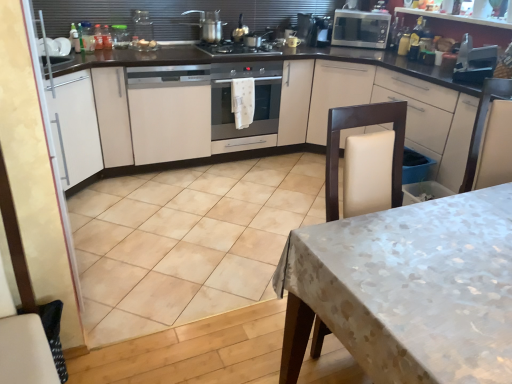
Describe the element at coordinates (74, 127) in the screenshot. I see `white matte cabinet at left, the first cabinetry viewed from the left` at that location.

Locate an element on the screen. This screenshot has width=512, height=384. metallic silver pot at upper center, the second kitchen appliance viewed from the back is located at coordinates (208, 25).

At what (x,y) coordinates should I click in order to perform the action: click on silver metallic microwave at upper right, placed as the first kitchen appliance when sorted from back to front. Please return your answer as a coordinate pair (x, y). Image resolution: width=512 pixels, height=384 pixels. Looking at the image, I should click on (360, 29).

What is the approximate height of white textured tablecloth at lower right?

white textured tablecloth at lower right is 29.78 inches in height.

Describe the element at coordinates (314, 29) in the screenshot. The image size is (512, 384). I see `metallic microwave at upper right, which appears as the 2th appliance when viewed from the front` at that location.

Identify the location of white matte cabinet at upper right, arranged as the 3th cabinetry when viewed from the left. (407, 111).

Could white matte cabinet at upper right, arranged as the 3th cabinetry when viewed from the left, be considered to be inside metallic microwave at upper right, positioned as the 1th appliance in top-to-bottom order?

No, white matte cabinet at upper right, arranged as the 3th cabinetry when viewed from the left, is not inside metallic microwave at upper right, positioned as the 1th appliance in top-to-bottom order.

Would you say metallic microwave at upper right, the 1th appliance in the left-to-right sequence, is to the left or to the right of white matte cabinet at upper right, arranged as the 3th cabinetry when viewed from the left, in the picture?

Based on their positions, metallic microwave at upper right, the 1th appliance in the left-to-right sequence, is located to the left of white matte cabinet at upper right, arranged as the 3th cabinetry when viewed from the left.

Is metallic microwave at upper right, the 1th appliance in the left-to-right sequence, oriented away from white matte cabinet at upper right, arranged as the 3th cabinetry when viewed from the left?

No, metallic microwave at upper right, the 1th appliance in the left-to-right sequence, is not facing the opposite direction of white matte cabinet at upper right, arranged as the 3th cabinetry when viewed from the left.

Considering the sizes of objects metallic microwave at upper right, which appears as the 2th appliance when viewed from the front, and white matte cabinet at upper right, arranged as the 3th cabinetry when viewed from the left, in the image provided, who is wider, metallic microwave at upper right, which appears as the 2th appliance when viewed from the front, or white matte cabinet at upper right, arranged as the 3th cabinetry when viewed from the left,?

white matte cabinet at upper right, arranged as the 3th cabinetry when viewed from the left, is wider.

Is black matte gas stove at center surrounded by white matte cabinet at center, the second cabinetry in the left-to-right sequence?

No.

Does point (148, 157) come in front of point (259, 51)?

Yes, it is in front of point (259, 51).

Between white matte cabinet at center, the second cabinetry in the left-to-right sequence, and black matte gas stove at center, which one appears on the left side from the viewer's perspective?

Positioned to the left is white matte cabinet at center, the second cabinetry in the left-to-right sequence.

Can you see white matte cabinet at center, the second cabinetry in the left-to-right sequence, touching black matte gas stove at center?

No, white matte cabinet at center, the second cabinetry in the left-to-right sequence, is not with black matte gas stove at center.

Based on the photo, is white textured tablecloth at lower right not close to white matte cabinet at left, the first cabinetry viewed from the left?

That's right, there is a large distance between white textured tablecloth at lower right and white matte cabinet at left, the first cabinetry viewed from the left.

From a real-world perspective, which object stands above the other?

white matte cabinet at left, the first cabinetry viewed from the left.

Considering the positions of points (298, 36) and (194, 113), is point (298, 36) farther from camera compared to point (194, 113)?

Yes.

From the image's perspective, which cabinetry is the 2nd one below the metallic microwave at upper right, the 1th appliance in the left-to-right sequence? Please provide its 2D coordinates.

[(169, 112)]

How much distance is there between metallic microwave at upper right, the 2th appliance ordered from the bottom, and white matte cabinet at center, the second cabinetry in the left-to-right sequence?

A distance of 1.45 meters exists between metallic microwave at upper right, the 2th appliance ordered from the bottom, and white matte cabinet at center, the second cabinetry in the left-to-right sequence.

Between metallic microwave at upper right, marked as the 2th appliance in a right-to-left arrangement, and white matte cabinet at center, the 2th cabinetry in the right-to-left sequence, which one appears on the right side from the viewer's perspective?

metallic microwave at upper right, marked as the 2th appliance in a right-to-left arrangement, is more to the right.

Considering the relative sizes of white textured tablecloth at lower right and black matte gas stove at center in the image provided, is white textured tablecloth at lower right wider than black matte gas stove at center?

Yes, white textured tablecloth at lower right is wider than black matte gas stove at center.

Between white textured tablecloth at lower right and black matte gas stove at center, which one appears on the right side from the viewer's perspective?

Positioned to the right is white textured tablecloth at lower right.

Is white textured tablecloth at lower right not close to black matte gas stove at center?

Yes, white textured tablecloth at lower right is far from black matte gas stove at center.

What's the angular difference between white textured tablecloth at lower right and black matte gas stove at center's facing directions?

91.3 degrees separate the facing orientations of white textured tablecloth at lower right and black matte gas stove at center.

Is white matte cabinet at left, the third cabinetry viewed from the right, thinner than black matte gas stove at center?

No.

Based on the photo, which object is further away from the camera taking this photo, white matte cabinet at left, the third cabinetry viewed from the right, or black matte gas stove at center?

black matte gas stove at center is further away from the camera.

Which of these two, white matte cabinet at left, the third cabinetry viewed from the right, or black matte gas stove at center, is bigger?

With larger size is white matte cabinet at left, the third cabinetry viewed from the right.

Considering the relative positions of white matte cabinet at left, the first cabinetry viewed from the left, and black matte gas stove at center in the image provided, is white matte cabinet at left, the first cabinetry viewed from the left, to the right of black matte gas stove at center from the viewer's perspective?

No, white matte cabinet at left, the first cabinetry viewed from the left, is not to the right of black matte gas stove at center.

Considering the sizes of objects white matte cabinet at center, the second cabinetry in the left-to-right sequence, and satin silver oven at center in the image provided, who is thinner, white matte cabinet at center, the second cabinetry in the left-to-right sequence, or satin silver oven at center?

satin silver oven at center is thinner.

Would you say white matte cabinet at center, the 2th cabinetry in the right-to-left sequence, is inside or outside satin silver oven at center?

white matte cabinet at center, the 2th cabinetry in the right-to-left sequence, is outside satin silver oven at center.

Between white matte cabinet at center, the second cabinetry in the left-to-right sequence, and satin silver oven at center, which one appears on the right side from the viewer's perspective?

Positioned to the right is satin silver oven at center.

From the picture: Which object is closer to the camera, white matte cabinet at center, the 2th cabinetry in the right-to-left sequence, or satin silver oven at center?

white matte cabinet at center, the 2th cabinetry in the right-to-left sequence.

Image resolution: width=512 pixels, height=384 pixels. In the image, there is a white matte cabinet at upper right, which is counted as the first cabinetry, starting from the right. What are the coordinates of `appliance above it (from the image's perspective)` in the screenshot? It's located at (314, 29).

This screenshot has width=512, height=384. What are the coordinates of `the 1st cabinetry in front of the black matte gas stove at center, starting your count from the anchor` in the screenshot? It's located at (169, 112).

Which object lies further to the anchor point metallic microwave at upper right, marked as the 2th appliance in a right-to-left arrangement, metallic silver toaster at upper right, arranged as the 2th appliance when viewed from the back, or black matte gas stove at center?

metallic silver toaster at upper right, arranged as the 2th appliance when viewed from the back, lies further to metallic microwave at upper right, marked as the 2th appliance in a right-to-left arrangement, than the other object.

Looking at the image, which one is located further to metallic silver toaster at upper right, placed as the first appliance when sorted from right to left, metallic silver pot at upper center, the second kitchen appliance viewed from the back, or white matte cabinet at center, the 2th cabinetry in the right-to-left sequence?

Among the two, white matte cabinet at center, the 2th cabinetry in the right-to-left sequence, is located further to metallic silver toaster at upper right, placed as the first appliance when sorted from right to left.

Which object lies further to the anchor point metallic silver pot at upper center, which appears as the 1th kitchen appliance when viewed from the left, silver metallic microwave at upper right, placed as the first kitchen appliance when sorted from back to front, or metallic silver toaster at upper right, which appears as the first appliance when viewed from the front?

metallic silver toaster at upper right, which appears as the first appliance when viewed from the front, is positioned further to the anchor metallic silver pot at upper center, which appears as the 1th kitchen appliance when viewed from the left.

Based on their spatial positions, is silver metallic microwave at upper right, the 2th kitchen appliance viewed from the front, or white matte cabinet at center, the second cabinetry in the left-to-right sequence, closer to white matte cabinet at left, the third cabinetry viewed from the right?

Based on the image, white matte cabinet at center, the second cabinetry in the left-to-right sequence, appears to be nearer to white matte cabinet at left, the third cabinetry viewed from the right.

From the picture: Considering their positions, is metallic microwave at upper right, the 1th appliance in the left-to-right sequence, positioned closer to metallic silver toaster at upper right, the 2th appliance positioned from the left, than black matte gas stove at center?

metallic microwave at upper right, the 1th appliance in the left-to-right sequence, is closer to metallic silver toaster at upper right, the 2th appliance positioned from the left.

When comparing their distances from white matte cabinet at left, the third cabinetry viewed from the right, does metallic microwave at upper right, which appears as the 2th appliance when viewed from the front, or white textured tablecloth at lower right seem further?

metallic microwave at upper right, which appears as the 2th appliance when viewed from the front, lies further to white matte cabinet at left, the third cabinetry viewed from the right, than the other object.

Considering their positions, is white matte cabinet at center, the 2th cabinetry in the right-to-left sequence, positioned closer to white textured tablecloth at lower right than white matte cabinet at left, the first cabinetry viewed from the left?

white matte cabinet at left, the first cabinetry viewed from the left, is positioned closer to the anchor white textured tablecloth at lower right.

Estimate the real-world distances between objects in this image. Which object is closer to white matte cabinet at upper right, arranged as the 3th cabinetry when viewed from the left, metallic silver pot at upper center, which appears as the 1th kitchen appliance when viewed from the left, or metallic silver toaster at upper right, which appears as the first appliance when viewed from the front?

metallic silver toaster at upper right, which appears as the first appliance when viewed from the front.

Where is `gas stove between white matte cabinet at left, the first cabinetry viewed from the left, and satin silver oven at center, in the horizontal direction`? This screenshot has height=384, width=512. gas stove between white matte cabinet at left, the first cabinetry viewed from the left, and satin silver oven at center, in the horizontal direction is located at coordinates (238, 49).

Locate an element on the screen. appliance between white textured tablecloth at lower right and metallic microwave at upper right, which appears as the 2th appliance when viewed from the front, along the z-axis is located at coordinates (474, 62).

This screenshot has height=384, width=512. Identify the location of kitchen appliance between white matte cabinet at center, the 2th cabinetry in the right-to-left sequence, and silver metallic microwave at upper right, placed as the first kitchen appliance when sorted from back to front, from left to right. (208, 25).

This screenshot has width=512, height=384. I want to click on home appliance located between white matte cabinet at center, the 2th cabinetry in the right-to-left sequence, and metallic silver toaster at upper right, the 2th appliance positioned from the left, in the left-right direction, so click(255, 99).